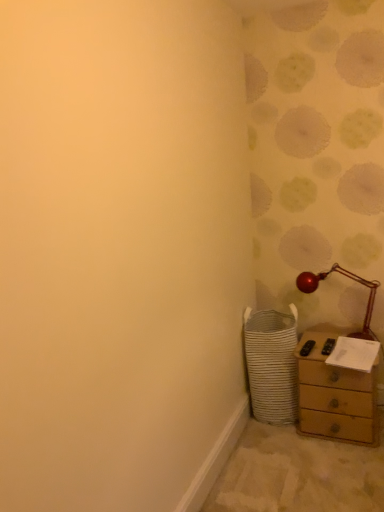
Question: From a real-world perspective, is metallic red table lamp at right physically located above or below white woven laundry basket at lower right?

Choices:
 (A) below
 (B) above

Answer: (B)

Question: In the image, is metallic red table lamp at right positioned in front of or behind white woven laundry basket at lower right?

Choices:
 (A) front
 (B) behind

Answer: (B)

Question: Considering the real-world distances, which object is closest to the white woven laundry basket at lower right?

Choices:
 (A) metallic red table lamp at right
 (B) wooden chest of drawers at lower right

Answer: (B)

Question: Estimate the real-world distances between objects in this image. Which object is farther from the wooden chest of drawers at lower right?

Choices:
 (A) metallic red table lamp at right
 (B) white woven laundry basket at lower right

Answer: (A)